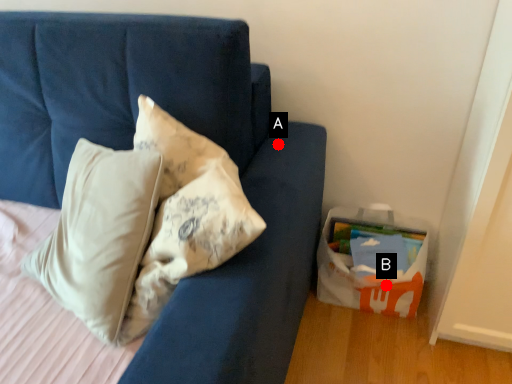
Question: Two points are circled on the image, labeled by A and B beside each circle. Which of the following is the closest to the observer?

Choices:
 (A) A is closer
 (B) B is closer

Answer: (A)